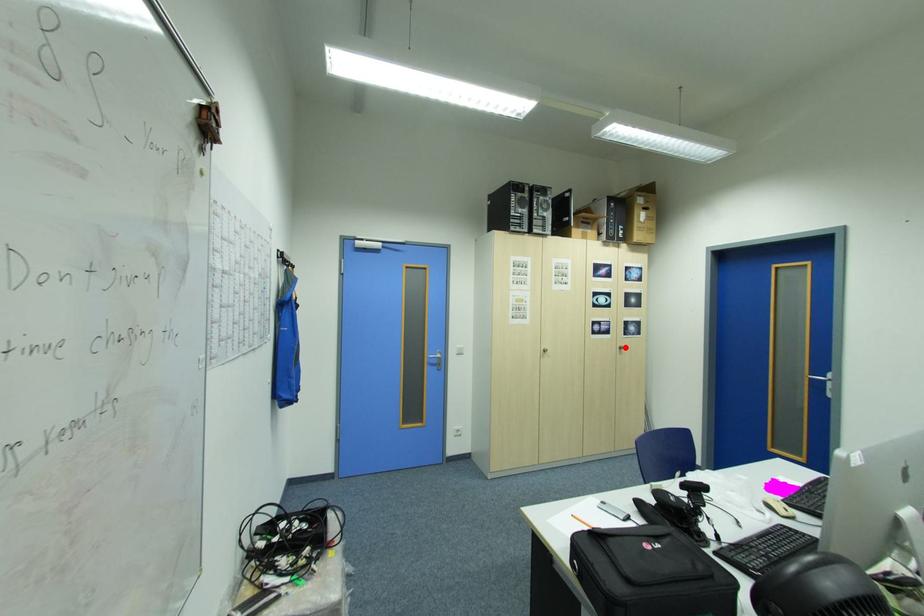
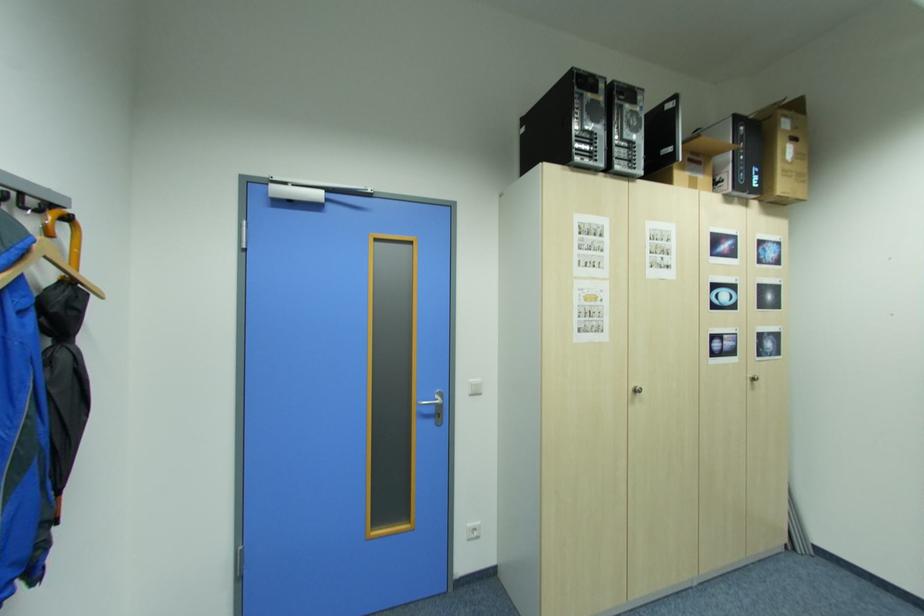
Question: A red point is marked in image1. In image2, is the corresponding 3D point closer to the camera or farther? Reply with the corresponding letter.

Choices:
 (A) The corresponding 3D point is closer.
 (B) The corresponding 3D point is farther.

Answer: (A)